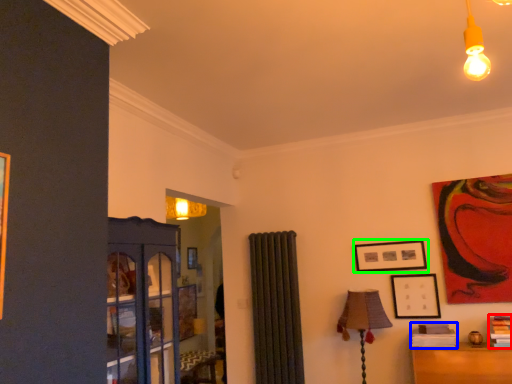
Question: Which object is positioned closest to book (highlighted by a red box)? Select from book (highlighted by a blue box) and picture frame (highlighted by a green box).

Choices:
 (A) book
 (B) picture frame

Answer: (A)